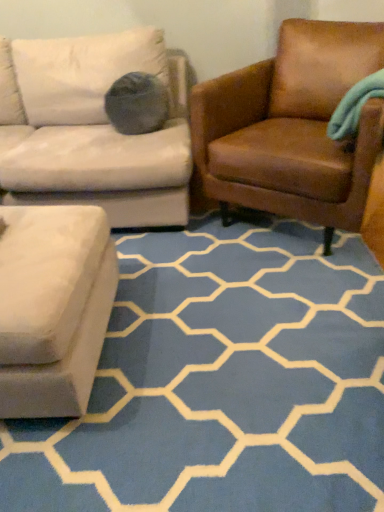
Question: Is point (238, 86) closer or farther from the camera than point (160, 391)?

Choices:
 (A) closer
 (B) farther

Answer: (B)

Question: Considering the relative positions of brown leather chair at right and blue carpet at lower center in the image provided, is brown leather chair at right to the left or to the right of blue carpet at lower center?

Choices:
 (A) right
 (B) left

Answer: (A)

Question: From the image's perspective, is brown leather chair at right positioned above or below blue carpet at lower center?

Choices:
 (A) below
 (B) above

Answer: (B)

Question: Based on their positions, is blue carpet at lower center located to the left or right of brown leather chair at right?

Choices:
 (A) left
 (B) right

Answer: (A)

Question: Which is correct: blue carpet at lower center is inside brown leather chair at right, or outside of it?

Choices:
 (A) outside
 (B) inside

Answer: (A)

Question: Considering the positions of blue carpet at lower center and brown leather chair at right in the image, is blue carpet at lower center taller or shorter than brown leather chair at right?

Choices:
 (A) tall
 (B) short

Answer: (B)

Question: Considering their positions, is blue carpet at lower center located in front of or behind brown leather chair at right?

Choices:
 (A) behind
 (B) front

Answer: (B)